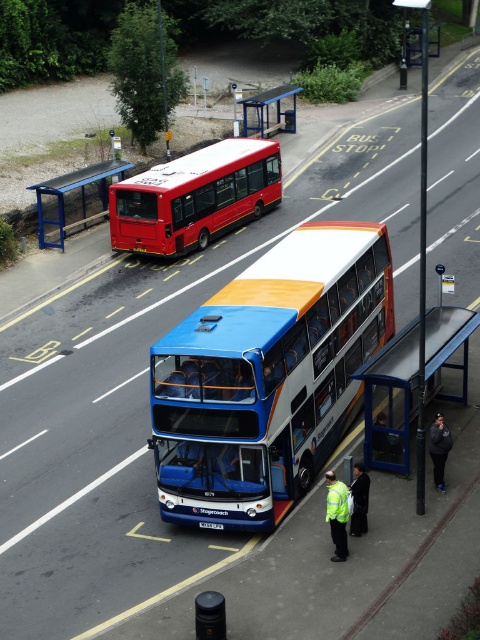
Question: Estimate the real-world distances between objects in this image. Which object is closer to the blue plastic bus stop at lower right?

Choices:
 (A) blue metallic decker bus at center
 (B) matte red bus at center

Answer: (A)

Question: Can you confirm if blue metallic decker bus at center is positioned below blue plastic bus stop at lower right?

Choices:
 (A) no
 (B) yes

Answer: (A)

Question: Does blue metallic decker bus at center appear over blue plastic bus stop at lower right?

Choices:
 (A) no
 (B) yes

Answer: (B)

Question: Which is nearer to the blue metal bus stop at upper left?

Choices:
 (A) matte red bus at center
 (B) blue plastic bus stop at lower right
 (C) blue metallic decker bus at center

Answer: (A)

Question: Can you confirm if blue plastic bus stop at lower right is wider than blue metal bus stop at upper left?

Choices:
 (A) no
 (B) yes

Answer: (B)

Question: Which of the following is the farthest from the observer?

Choices:
 (A) blue plastic bus stop at lower right
 (B) blue metallic decker bus at center
 (C) matte red bus at center

Answer: (C)